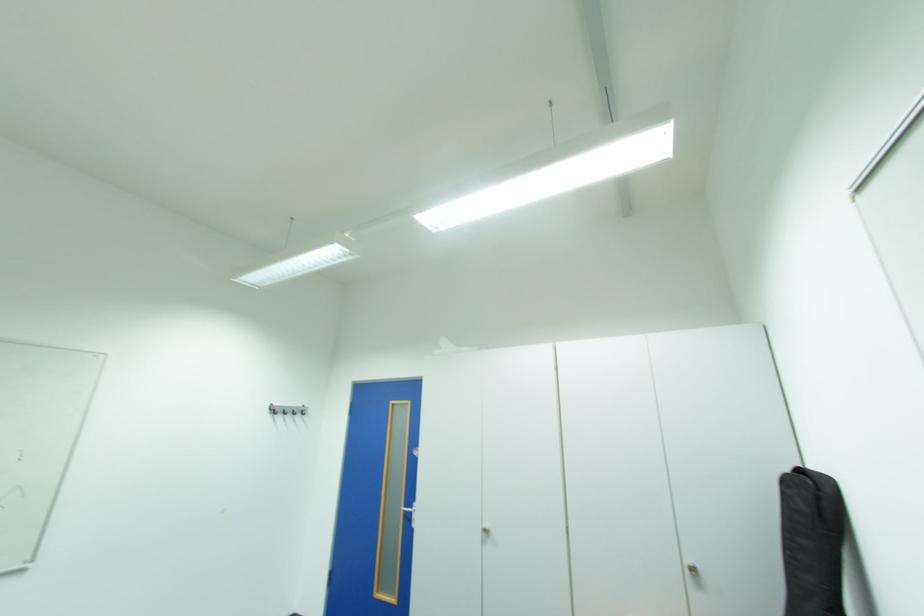
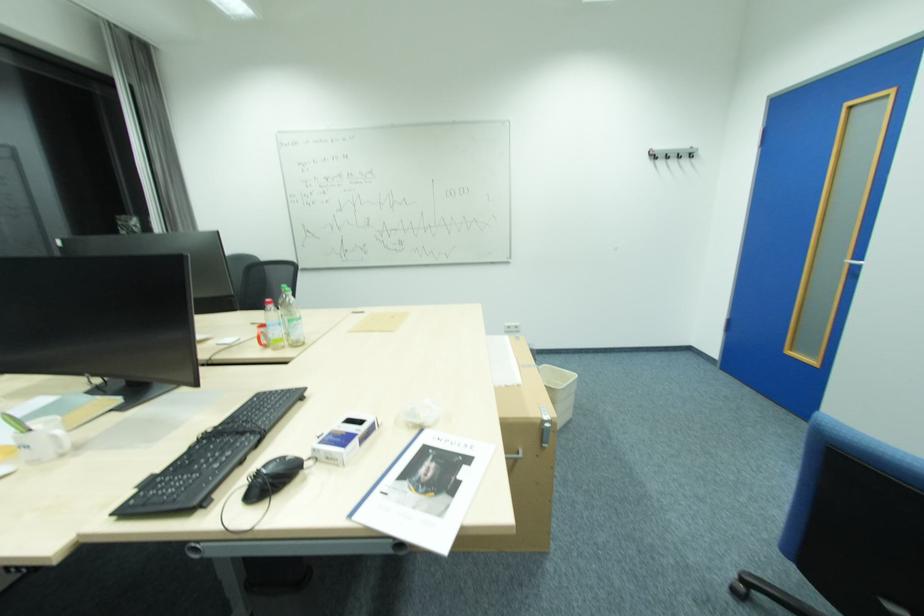
Looking at this image, how did the camera likely rotate?

The camera's rotation is toward left-down.